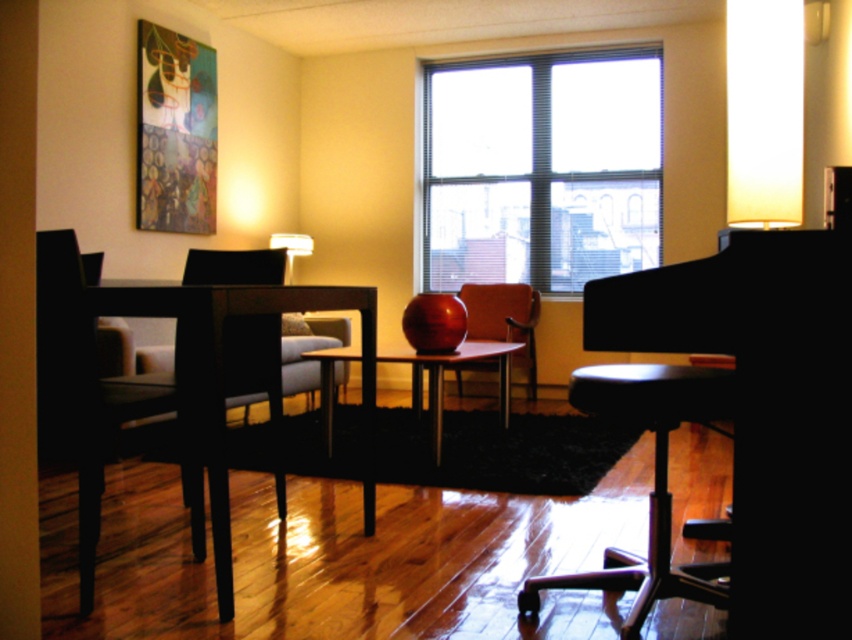
You are a guest in the living room and want to sit down. You see the black glossy piano at center and the matte orange chair at center. Which object is shorter and therefore more suitable for sitting?

The black glossy piano at center is shorter than the matte orange chair at center, so it is more suitable for sitting.

You are a delivery person who needs to place a package that is 30 centimeters wide between the black glossy piano at center and the black plastic stool at lower right. Can you fit the package there?

The distance between the black glossy piano at center and the black plastic stool at lower right is 32.30 centimeters. Since the package is 30 centimeters wide, there is enough space to fit it between them.

You are standing in the living space and want to move from the dining area to the wall with the abstract painting. Which object, the black glossy piano at center or the matte wood table at center, will you pass closer to as you walk towards the painting?

The black glossy piano at center is closer to the viewer than the matte wood table at center, so you will pass closer to the black glossy piano at center as you walk towards the wall with the abstract painting.